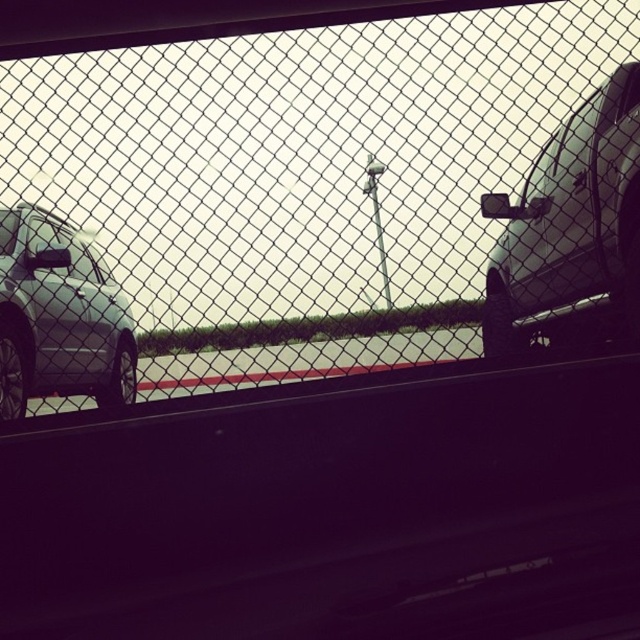
Describe the element at coordinates (301, 182) in the screenshot. I see `wire mesh fence at center` at that location.

Where is `wire mesh fence at center`? The image size is (640, 640). wire mesh fence at center is located at coordinates (301, 182).

Locate an element on the screen. wire mesh fence at center is located at coordinates (301, 182).

Which of these two, satin silver car at right or matte silver suv at left, stands shorter?

matte silver suv at left

Which is in front, point (572, 131) or point (77, 392)?

Positioned in front is point (572, 131).

Image resolution: width=640 pixels, height=640 pixels. I want to click on satin silver car at right, so click(x=572, y=218).

Between wire mesh fence at center and satin silver car at right, which one is positioned lower?

Positioned lower is satin silver car at right.

From the picture: Does wire mesh fence at center appear on the right side of satin silver car at right?

In fact, wire mesh fence at center is to the left of satin silver car at right.

Does point (541, 218) come closer to viewer compared to point (582, 282)?

That is False.

This screenshot has width=640, height=640. I want to click on wire mesh fence at center, so (301, 182).